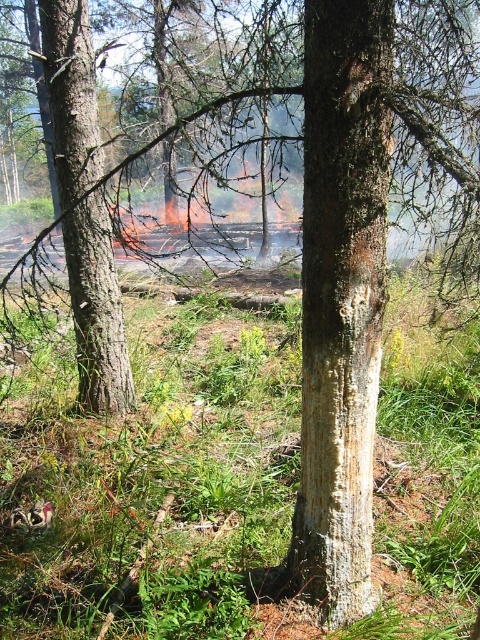
Question: Does smooth brown tree trunk at center have a larger size compared to smooth brown tree trunk at left?

Choices:
 (A) no
 (B) yes

Answer: (A)

Question: Can you confirm if smooth brown tree trunk at center is smaller than smooth brown tree trunk at left?

Choices:
 (A) no
 (B) yes

Answer: (B)

Question: Observing the image, what is the correct spatial positioning of smooth brown tree trunk at center in reference to smooth brown tree trunk at left?

Choices:
 (A) left
 (B) right

Answer: (B)

Question: Which point is farther from the camera taking this photo?

Choices:
 (A) (124, 406)
 (B) (309, 413)

Answer: (A)

Question: Among these points, which one is farthest from the camera?

Choices:
 (A) pos(360,1)
 (B) pos(52,141)

Answer: (B)